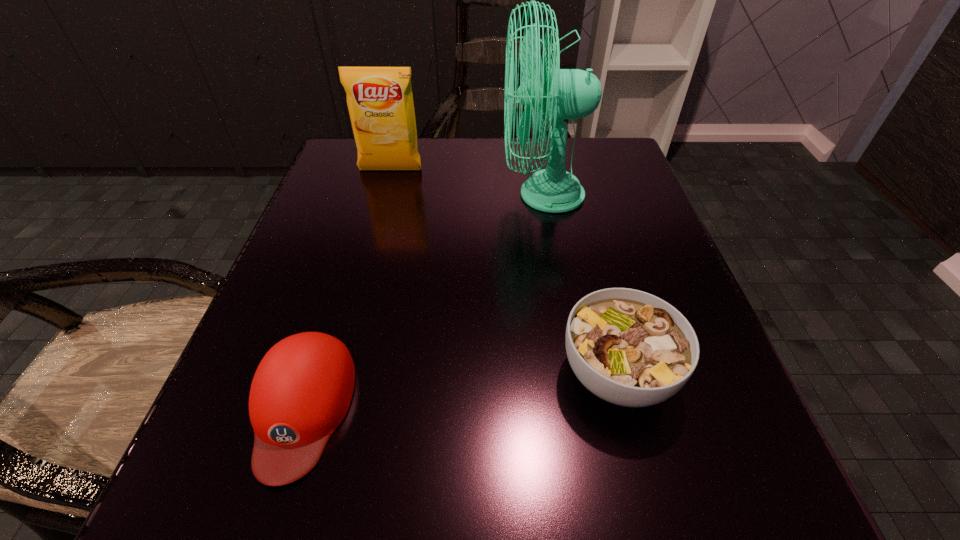
This screenshot has height=540, width=960. What are the coordinates of `crisp (potato chip) positioned at the far edge` in the screenshot? It's located at (380, 102).

This screenshot has width=960, height=540. I want to click on object that is at the near edge, so click(301, 391).

You are a GUI agent. You are given a task and a screenshot of the screen. Output one action in this format:
    pyautogui.click(x=<x>, y=<y>)
    Task: Click on the crisp (potato chip) that is at the left edge
    
    Given the screenshot: What is the action you would take?
    pyautogui.click(x=380, y=102)

The width and height of the screenshot is (960, 540). Identify the location of baseball cap present at the left edge. (301, 391).

Image resolution: width=960 pixels, height=540 pixels. What are the coordinates of `fan at the right edge` in the screenshot? It's located at (570, 93).

I want to click on soup bowl at the right edge, so click(x=628, y=347).

Identify the location of object at the far left corner. (380, 102).

Identify the location of object that is at the near left corner. The image size is (960, 540). (301, 391).

The image size is (960, 540). Find the location of `object at the far right corner`. object at the far right corner is located at coordinates (570, 93).

Where is `vacant area at the far edge`? This screenshot has height=540, width=960. vacant area at the far edge is located at coordinates (437, 149).